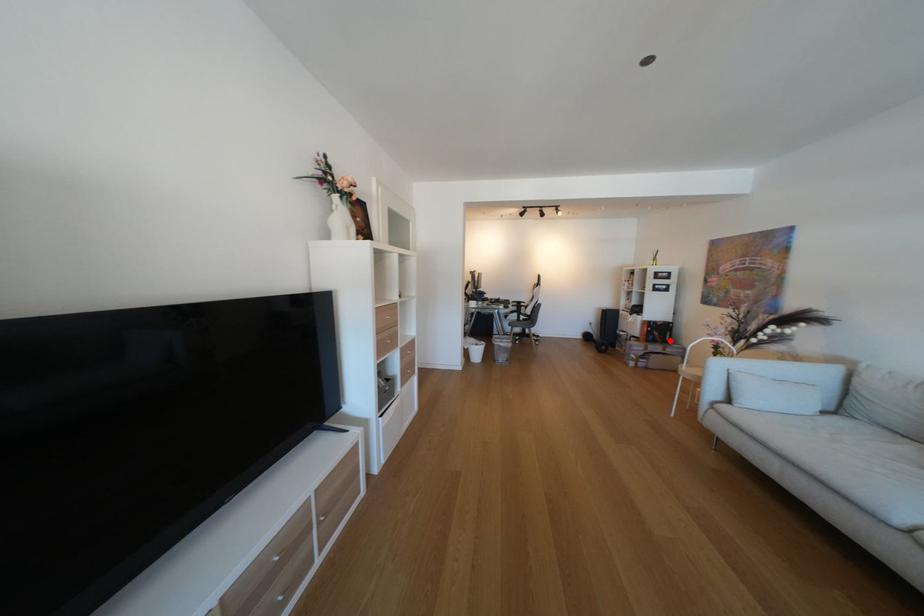
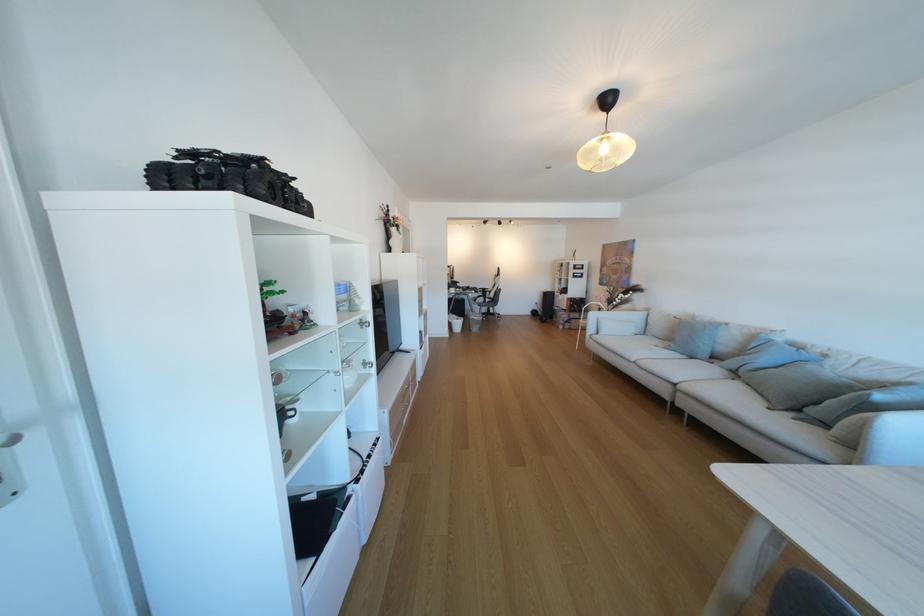
Question: A red point is marked in image1. In image2, is the corresponding 3D point closer to the camera or farther? Reply with the corresponding letter.

Choices:
 (A) The corresponding 3D point is closer.
 (B) The corresponding 3D point is farther.

Answer: (A)